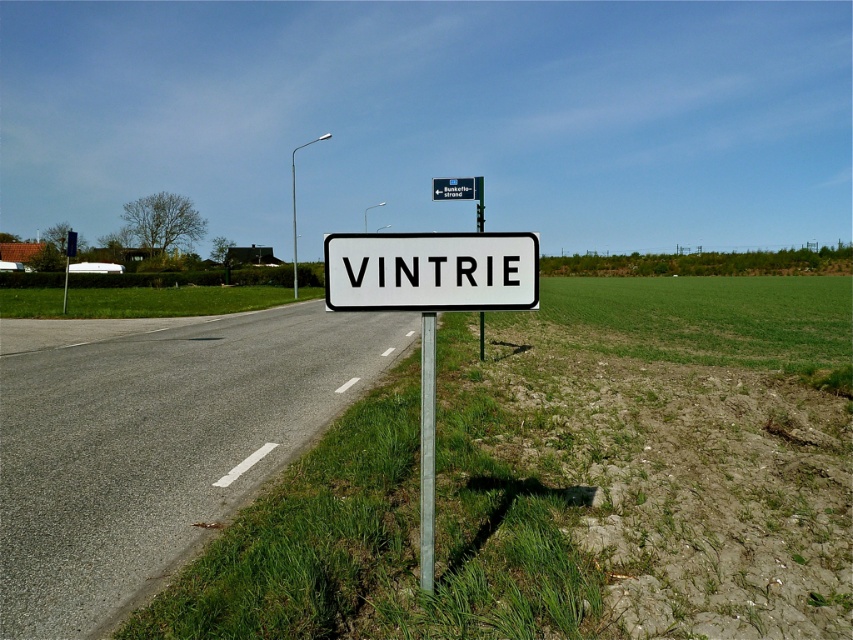
Question: Which object is positioned farthest from the white plastic sign at center?

Choices:
 (A) green plastic sign at center
 (B) metallic pole at center
 (C) gray asphalt road at center

Answer: (A)

Question: Is gray asphalt road at center further to camera compared to green plastic sign at center?

Choices:
 (A) no
 (B) yes

Answer: (A)

Question: Is white plastic sign at center behind green plastic sign at center?

Choices:
 (A) no
 (B) yes

Answer: (A)

Question: Can you confirm if gray asphalt road at center is wider than green plastic sign at center?

Choices:
 (A) no
 (B) yes

Answer: (B)

Question: Estimate the real-world distances between objects in this image. Which object is closer to the gray asphalt road at center?

Choices:
 (A) green plastic sign at center
 (B) metallic pole at center

Answer: (A)

Question: Among these objects, which one is farthest from the camera?

Choices:
 (A) gray asphalt road at center
 (B) metallic pole at center

Answer: (B)